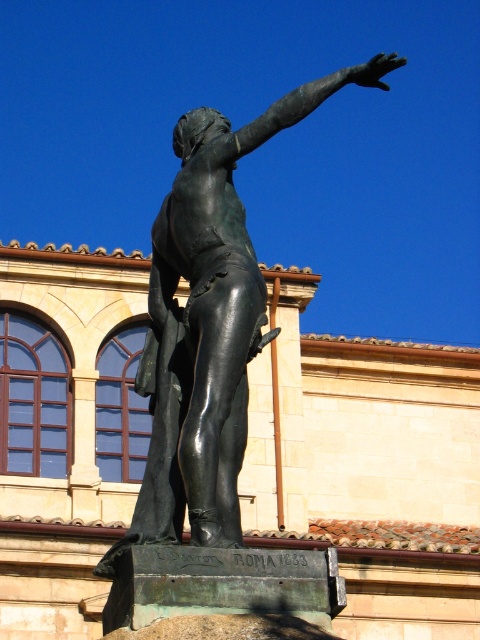
You are an art student analyzing the statue. You notice the shiny bronze statue at center and the bronze arm at upper right. Which object appears larger in the image?

The bronze arm at upper right appears larger than the shiny bronze statue at center.

You are an art student analyzing the statue. You notice the shiny bronze statue at center and the bronze arm at upper right. Which object is taller?

The bronze arm at upper right is taller than the shiny bronze statue at center.